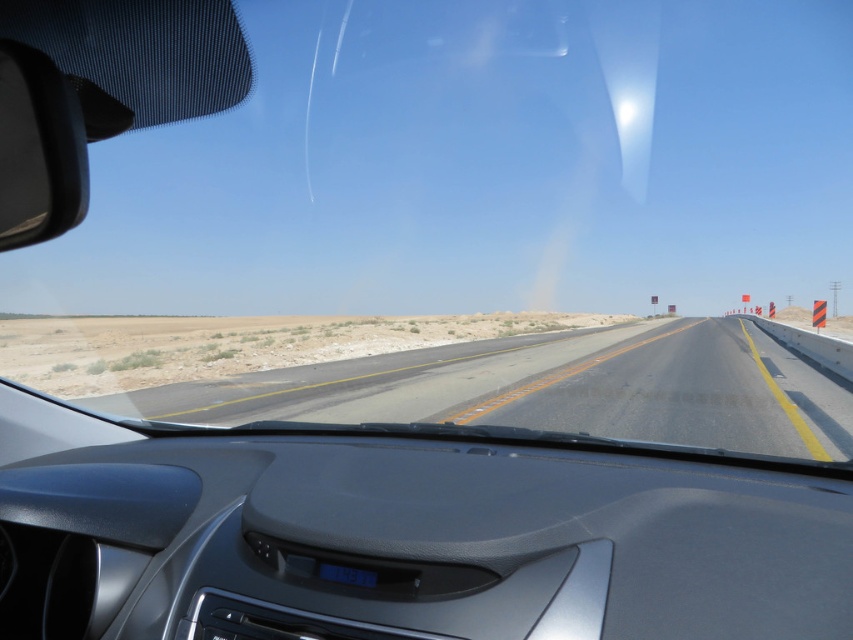
Question: Is asphalt road at center positioned in front of black glossy view mirror at left?

Choices:
 (A) yes
 (B) no

Answer: (B)

Question: Among these objects, which one is farthest from the camera?

Choices:
 (A) black glossy view mirror at left
 (B) asphalt road at center

Answer: (B)

Question: Which point is farther from the camera taking this photo?

Choices:
 (A) click(57, 160)
 (B) click(366, 400)

Answer: (B)

Question: Among these points, which one is nearest to the camera?

Choices:
 (A) (647, 372)
 (B) (44, 147)

Answer: (B)

Question: Can you confirm if asphalt road at center is positioned below black glossy view mirror at left?

Choices:
 (A) no
 (B) yes

Answer: (B)

Question: Can you confirm if asphalt road at center is smaller than black glossy view mirror at left?

Choices:
 (A) yes
 (B) no

Answer: (B)